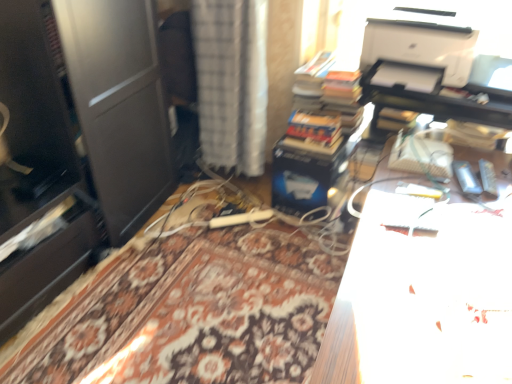
Find the location of a particular element. vacant area on top of white glossy paper at upper right (from a real-world perspective) is located at coordinates (444, 258).